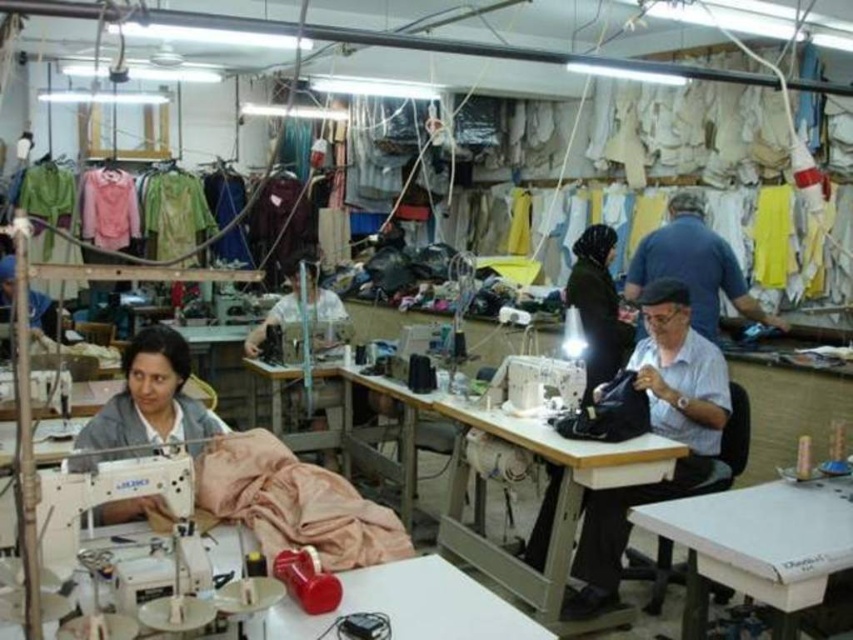
You are a worker in the garment factory and need to choose between the light blue fabric at center and the dark green fabric at center for a project that requires a wider fabric. Which fabric should you select?

The light blue fabric at center has a larger width than the dark green fabric at center, so you should select the light blue fabric at center for the project that requires a wider fabric.

Please look at the point marked at coordinates (x=656, y=433). What color fabric is located there?

The point at coordinates (x=656, y=433) marks light blue fabric at center.